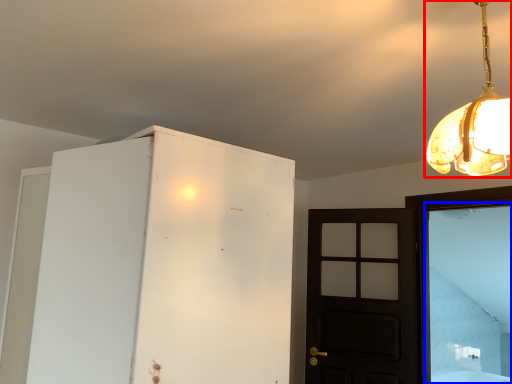
Question: Which object is further to the camera taking this photo, lamp (highlighted by a red box) or window (highlighted by a blue box)?

Choices:
 (A) lamp
 (B) window

Answer: (B)